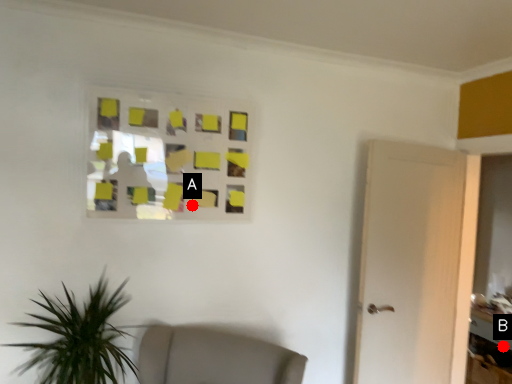
Question: Two points are circled on the image, labeled by A and B beside each circle. Which point is farther to the camera?

Choices:
 (A) A is further
 (B) B is further

Answer: (B)